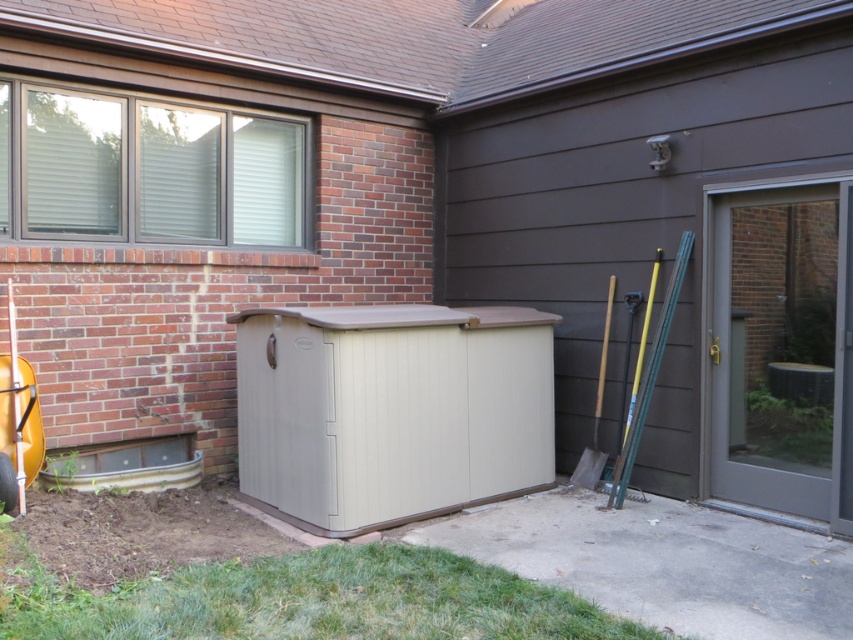
Which is below, matte gray screen door at right or wooden shovel at right?

Positioned lower is wooden shovel at right.

Who is higher up, matte gray screen door at right or wooden shovel at right?

matte gray screen door at right is above.

Who is more distant from viewer, (833, 244) or (598, 381)?

Positioned behind is point (598, 381).

This screenshot has height=640, width=853. In order to click on matte gray screen door at right in this screenshot , I will do click(782, 349).